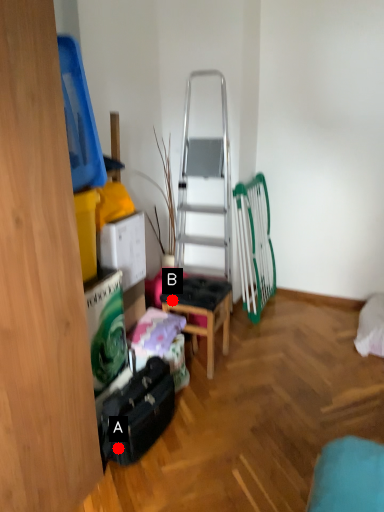
Question: Two points are circled on the image, labeled by A and B beside each circle. Which point is closer to the camera?

Choices:
 (A) A is closer
 (B) B is closer

Answer: (A)